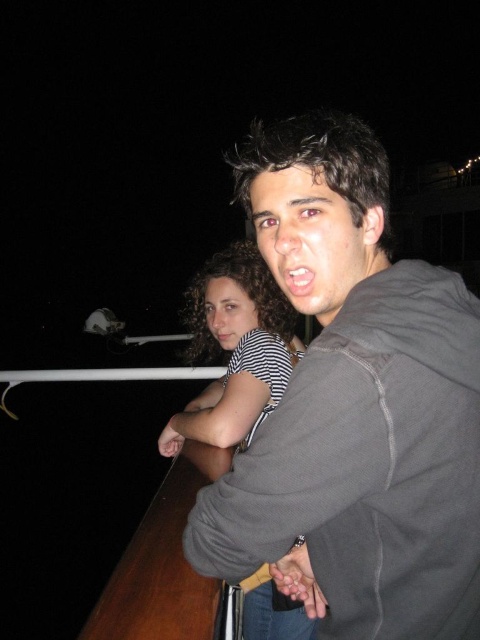
Can you confirm if dark gray hoodie at center is smaller than striped fabric shirt at upper center?

Correct, dark gray hoodie at center occupies less space than striped fabric shirt at upper center.

Which is more to the left, dark gray hoodie at center or striped fabric shirt at upper center?

Positioned to the left is striped fabric shirt at upper center.

Between point (475, 570) and point (199, 324), which one is positioned behind?

The point (199, 324) is behind.

What are the coordinates of `dark gray hoodie at center` in the screenshot? It's located at (355, 406).